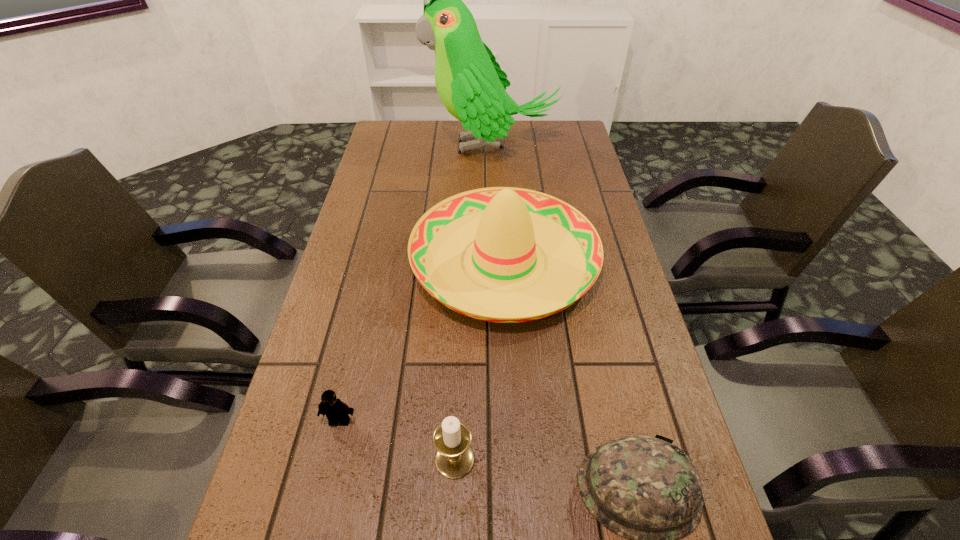
Image resolution: width=960 pixels, height=540 pixels. What are the coordinates of `free location located on the back of the fourth shortest object` in the screenshot? It's located at (499, 177).

The width and height of the screenshot is (960, 540). I want to click on free point located 0.390m on the right of the candle holder, so click(686, 458).

Locate an element on the screen. This screenshot has height=540, width=960. vacant space located 0.080m on the face of the third farthest object is located at coordinates pyautogui.click(x=328, y=469).

Locate an element on the screen. This screenshot has height=540, width=960. object present at the far edge is located at coordinates (470, 83).

Locate an element on the screen. The height and width of the screenshot is (540, 960). object located in the left edge section of the desktop is located at coordinates (335, 410).

Where is `parakeet positioned at the right edge`? The height and width of the screenshot is (540, 960). parakeet positioned at the right edge is located at coordinates (470, 83).

Where is `sombrero present at the right edge`? This screenshot has width=960, height=540. sombrero present at the right edge is located at coordinates (504, 281).

Where is `object that is at the far right corner`? object that is at the far right corner is located at coordinates (470, 83).

Identify the location of vacant area at the far edge. The width and height of the screenshot is (960, 540). (433, 129).

At what (x,y) coordinates should I click in order to perform the action: click on vacant area at the left edge of the desktop. Please return your answer as a coordinate pair (x, y). This screenshot has height=540, width=960. Looking at the image, I should click on (369, 217).